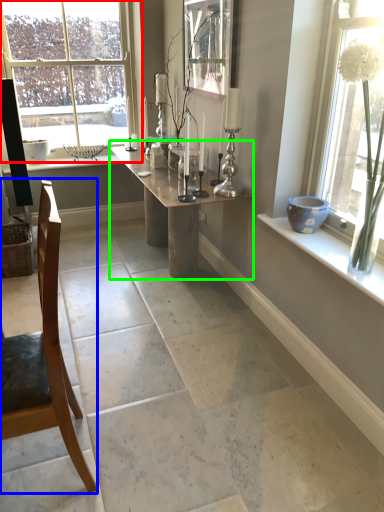
Question: Based on their relative distances, which object is nearer to window (highlighted by a red box)? Choose from chair (highlighted by a blue box) and table (highlighted by a green box).

Choices:
 (A) chair
 (B) table

Answer: (B)